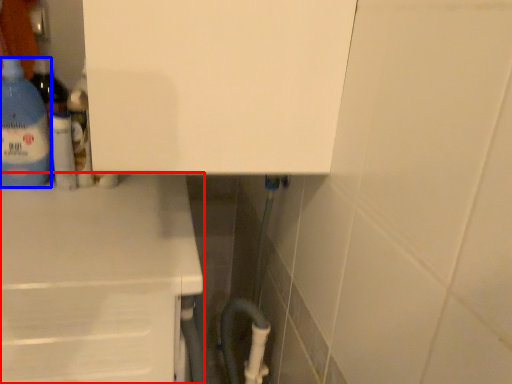
Question: Among these objects, which one is nearest to the camera, counter (highlighted by a red box) or bottle (highlighted by a blue box)?

Choices:
 (A) counter
 (B) bottle

Answer: (A)